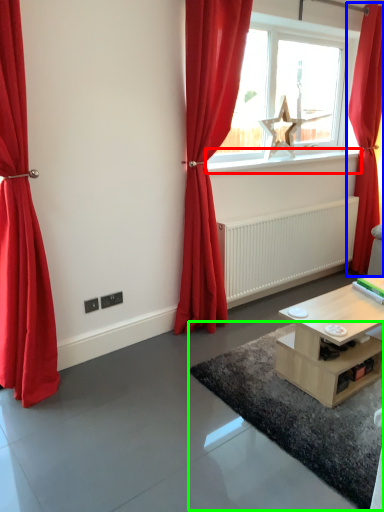
Question: Which object is positioned closest to window sill (highlighted by a red box)? Select from curtain (highlighted by a blue box) and plain (highlighted by a green box).

Choices:
 (A) curtain
 (B) plain

Answer: (A)